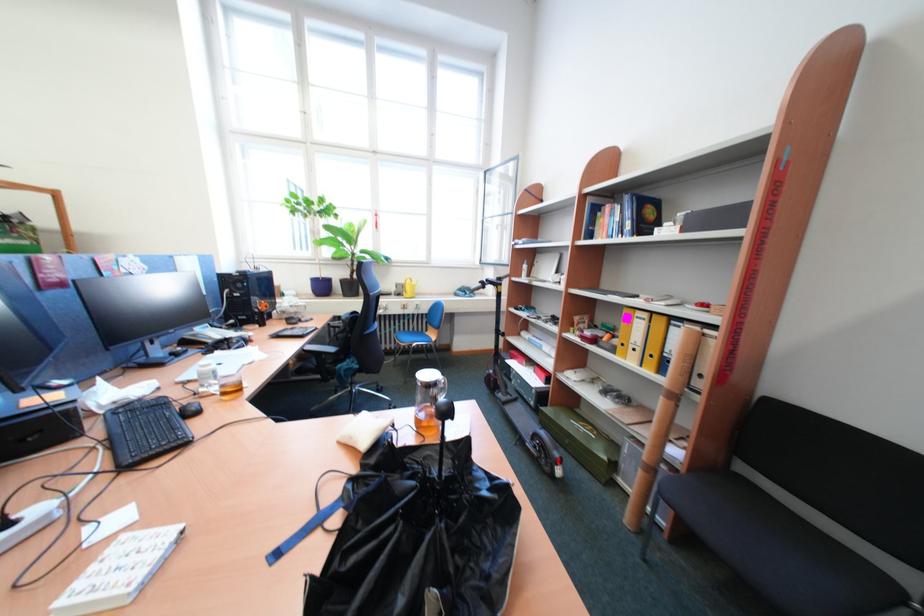
You are a GUI agent. You are given a task and a screenshot of the screen. Output one action in this format:
    pyautogui.click(x=<x>, y=<y>)
    Task: Click on the pitcher lid handle
    The width and height of the screenshot is (924, 616).
    Given the screenshot: What is the action you would take?
    (406, 288)